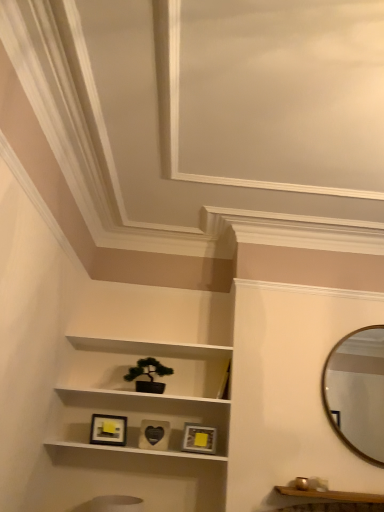
Question: Looking at their shapes, would you say matte black picture frame at lower center, which is counted as the first picture frame, starting from the left, is wider or thinner than matte gold picture frame at center, positioned as the first picture frame in right-to-left order?

Choices:
 (A) wide
 (B) thin

Answer: (B)

Question: In terms of height, does matte black picture frame at lower center, marked as the 3th picture frame in a right-to-left arrangement, look taller or shorter compared to matte gold picture frame at center, which is counted as the 3th picture frame, starting from the left?

Choices:
 (A) tall
 (B) short

Answer: (A)

Question: Which object is positioned closest to the wooden shelf at lower right?

Choices:
 (A) matte black picture frame at lower center, marked as the 3th picture frame in a right-to-left arrangement
 (B) black matte heart at center, the second picture frame viewed from the left
 (C) gold metallic mirror at upper right
 (D) green matte houseplant at center
 (E) matte gold picture frame at center, which is counted as the 3th picture frame, starting from the left

Answer: (C)

Question: Based on their relative distances, which object is nearer to the black matte heart at center, the second picture frame viewed from the left?

Choices:
 (A) matte black picture frame at lower center, which is counted as the first picture frame, starting from the left
 (B) green matte houseplant at center
 (C) matte gold picture frame at center, which is counted as the 3th picture frame, starting from the left
 (D) wooden shelf at lower right
 (E) white matte shelf at center

Answer: (A)